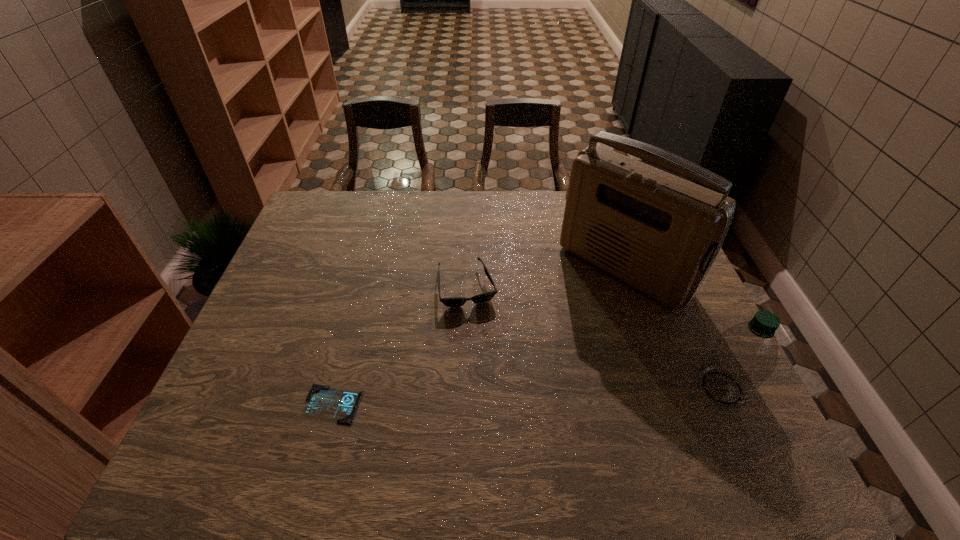
You are a GUI agent. You are given a task and a screenshot of the screen. Output one action in this format:
    pyautogui.click(x=<x>, y=<y>)
    Task: Click on the free space located on the front-facing side of the radio receiver
    This screenshot has width=960, height=540.
    Given the screenshot: What is the action you would take?
    pyautogui.click(x=576, y=312)

Identify the location of vacant point located on the front-facing side of the third object from right to left. (503, 424).

Where is `vacant region located 0.180m on the front-facing side of the third object from right to left`? Image resolution: width=960 pixels, height=540 pixels. vacant region located 0.180m on the front-facing side of the third object from right to left is located at coordinates (488, 367).

The height and width of the screenshot is (540, 960). Identify the location of vacant space located 0.230m on the front-facing side of the third object from right to left. (492, 384).

Identify the location of object present at the far edge. (659, 233).

Identify the location of identity card that is at the near edge. (322, 401).

Locate an element on the screen. The image size is (960, 540). water bottle present at the near edge is located at coordinates tap(743, 356).

This screenshot has height=540, width=960. I want to click on water bottle positioned at the right edge, so click(x=743, y=356).

This screenshot has width=960, height=540. Identify the location of radio receiver at the right edge. (659, 233).

The height and width of the screenshot is (540, 960). Find the location of `object that is at the far right corner`. object that is at the far right corner is located at coordinates (659, 233).